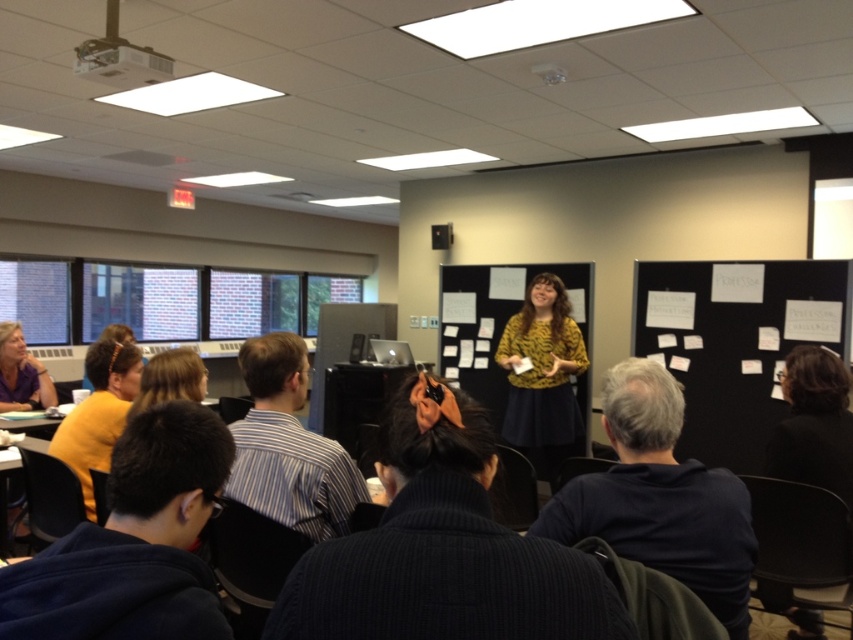
Is black fabric bulletin board at center to the left of blonde hair at center from the viewer's perspective?

Incorrect, black fabric bulletin board at center is not on the left side of blonde hair at center.

Who is positioned more to the right, black fabric bulletin board at center or blonde hair at center?

black fabric bulletin board at center is more to the right.

Which is behind, point (732, 330) or point (181, 394)?

The point (732, 330) is more distant.

The width and height of the screenshot is (853, 640). I want to click on black fabric bulletin board at center, so click(735, 342).

Who is positioned more to the right, yellow leopard print sweater at center or matte white projector at upper left?

From the viewer's perspective, yellow leopard print sweater at center appears more on the right side.

Which is more to the left, yellow leopard print sweater at center or matte white projector at upper left?

Positioned to the left is matte white projector at upper left.

Measure the distance between point (x=561, y=304) and camera.

A distance of 4.56 meters exists between point (x=561, y=304) and camera.

Identify the location of yellow leopard print sweater at center. The height and width of the screenshot is (640, 853). (543, 376).

Which is more to the right, black fabric jacket at lower right or matte white projector at upper left?

black fabric jacket at lower right

Is black fabric jacket at lower right shorter than matte white projector at upper left?

Incorrect, black fabric jacket at lower right's height does not fall short of matte white projector at upper left's.

Describe the element at coordinates (814, 422) in the screenshot. The height and width of the screenshot is (640, 853). I see `black fabric jacket at lower right` at that location.

The height and width of the screenshot is (640, 853). In order to click on black fabric jacket at lower right in this screenshot , I will do `click(814, 422)`.